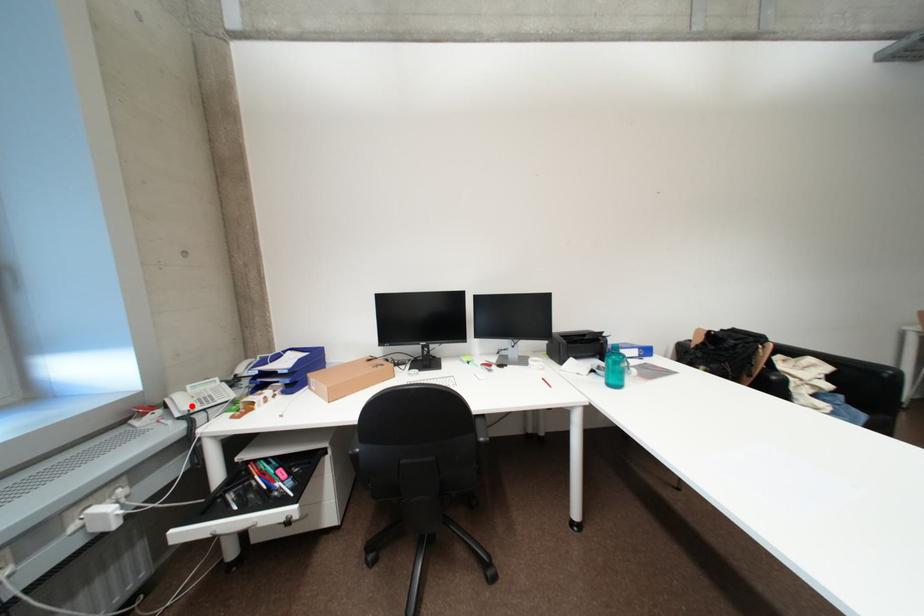
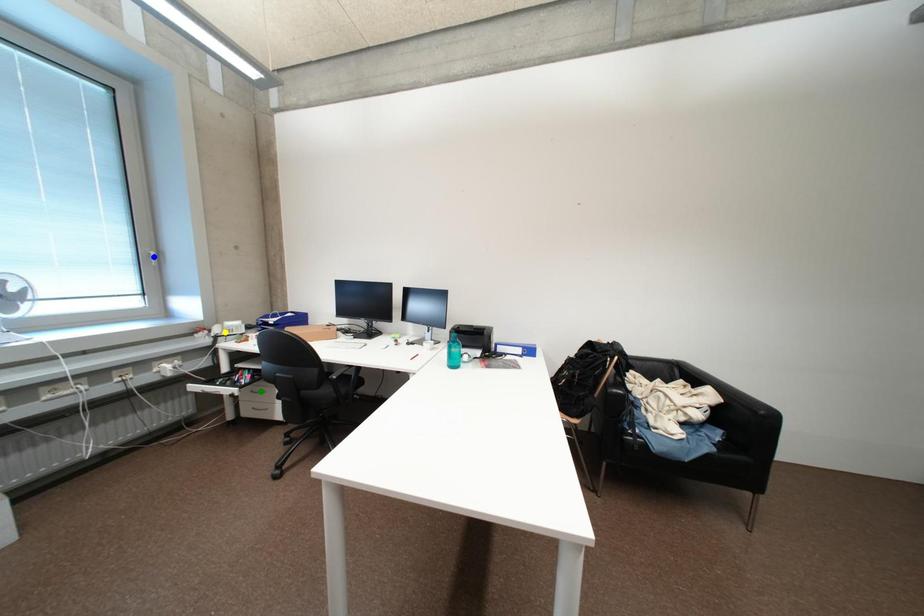
Question: I am providing you with two images of the same scene from different viewpoints. A red point is marked on the first image. You are given multiple points on the second image. Which point in image 2 is actually the same real-world point as the red point in image 1?

Choices:
 (A) blue point
 (B) green point
 (C) yellow point

Answer: (C)